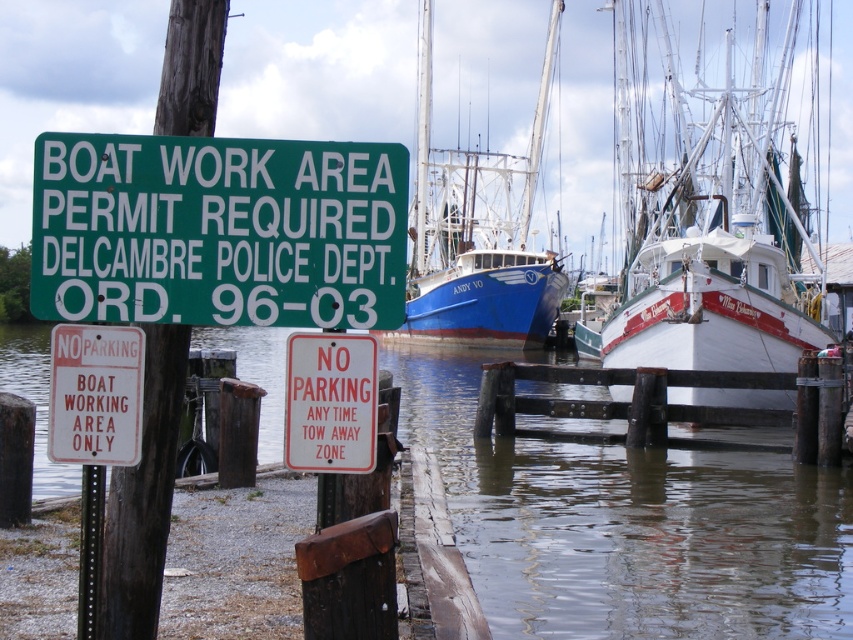
You are a visitor trying to park your car at the marina. You see the clear water at dock center and the white paper sign at lower left. Which one is wider?

The clear water at dock center is wider than the white paper sign at lower left.